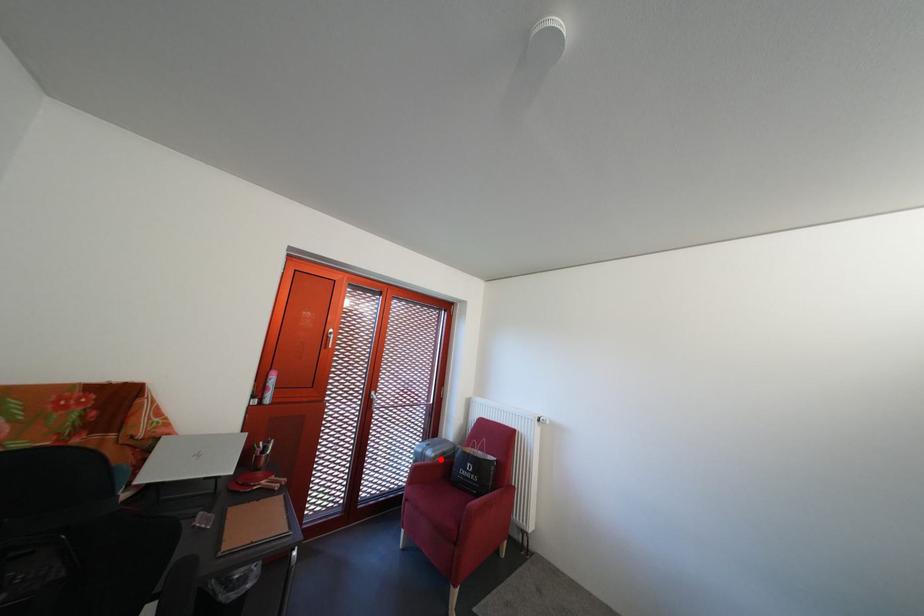
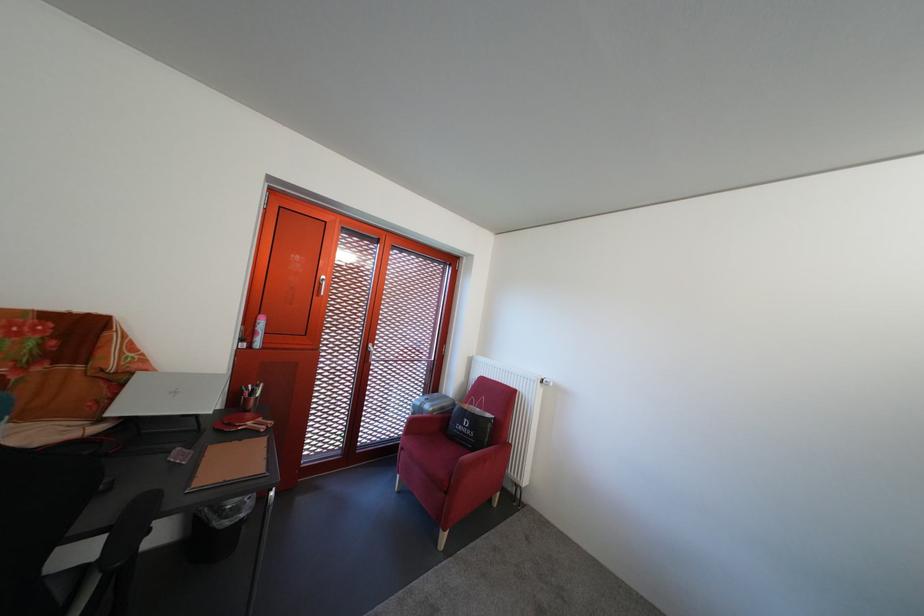
Question: I am providing you with two images of the same scene from different viewpoints. Image1 has a red point marked. In image2, the corresponding 3D location appears at what relative position? Reply with the corresponding letter.

Choices:
 (A) Closer
 (B) Farther

Answer: (A)